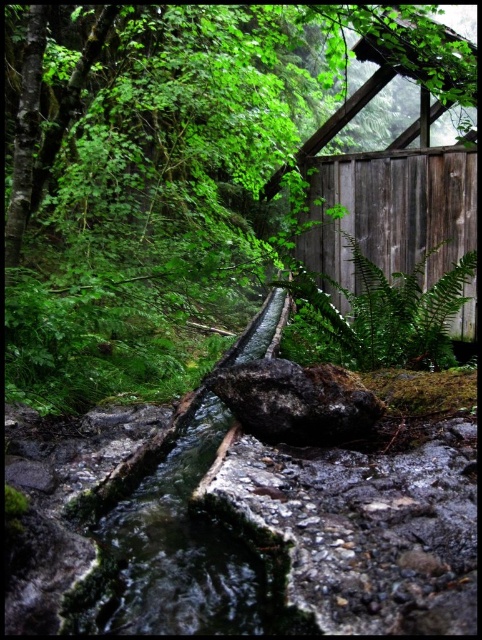
Is point (269, 28) positioned before point (428, 285)?

No, (269, 28) is behind (428, 285).

Can you confirm if green leafy tree at center is positioned below wooden hut at upper right?

Yes.

At what (x,y) coordinates should I click in order to perform the action: click on green leafy tree at center. Please return your answer as a coordinate pair (x, y). The width and height of the screenshot is (482, 640). Looking at the image, I should click on (168, 177).

Image resolution: width=482 pixels, height=640 pixels. Identify the location of green leafy tree at center. (168, 177).

Does green leafy fern at center come in front of rough textured rock at center?

No, green leafy fern at center is further to the viewer.

Does green leafy fern at center have a smaller size compared to rough textured rock at center?

Incorrect, green leafy fern at center is not smaller in size than rough textured rock at center.

Is point (359, 340) positioned after point (370, 390)?

Yes, point (359, 340) is behind point (370, 390).

The width and height of the screenshot is (482, 640). I want to click on green leafy fern at center, so click(x=388, y=312).

Is green leafy tree at center positioned before green leafy fern at center?

That is False.

Which is below, green leafy tree at center or green leafy fern at center?

green leafy fern at center is below.

Locate an element on the screen. The width and height of the screenshot is (482, 640). green leafy tree at center is located at coordinates (168, 177).